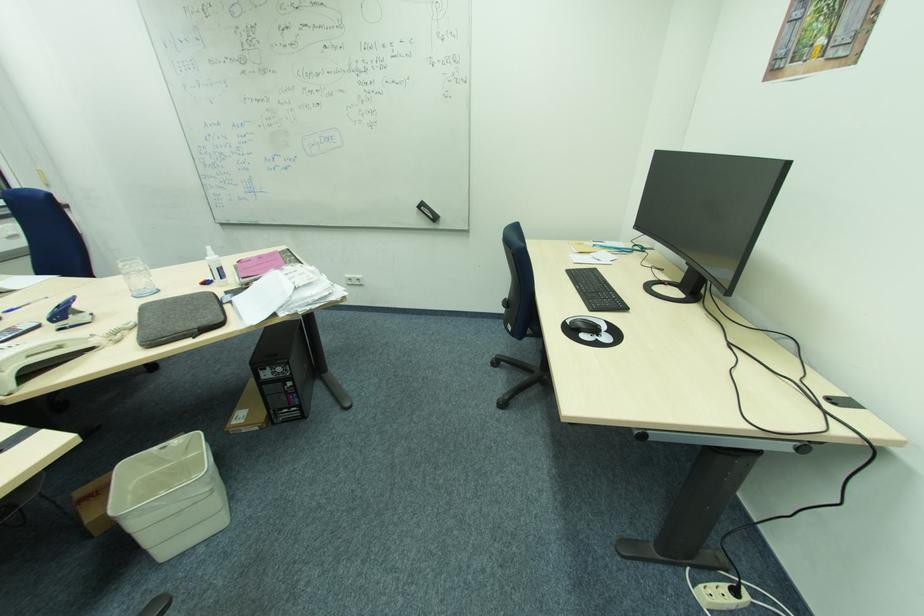
Find where to press the spray bottle nozzle. Please return your answer as a coordinate pair (x, y).

(210, 251)